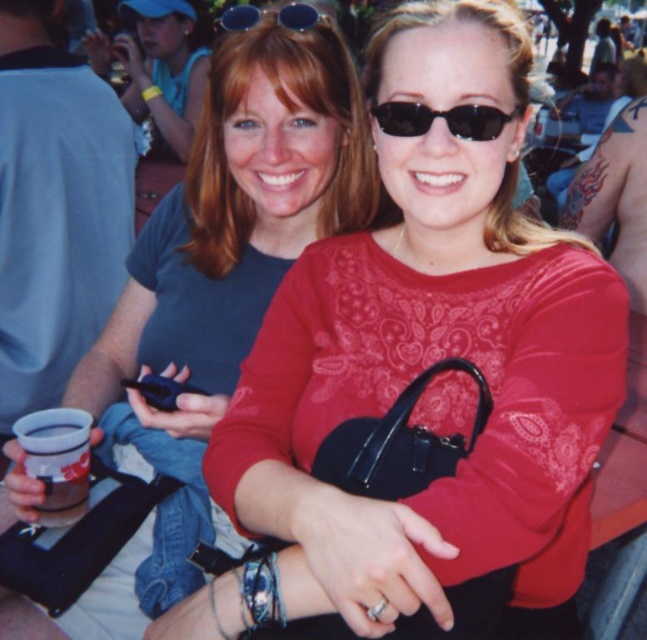
Between point (488, 124) and point (236, 29), which one is positioned in front?

Positioned in front is point (488, 124).

Is the position of black plastic sunglasses at center less distant than that of sunglasses at upper center?

That is True.

Does point (499, 122) come farther from viewer compared to point (280, 20)?

That is False.

Identify the location of black plastic sunglasses at center. The width and height of the screenshot is (647, 640). (441, 116).

The height and width of the screenshot is (640, 647). What do you see at coordinates (225, 260) in the screenshot? I see `matte black purse at center` at bounding box center [225, 260].

Does matte black purse at center have a greater height compared to black plastic sunglasses at center?

Yes.

Describe the element at coordinates (225, 260) in the screenshot. I see `matte black purse at center` at that location.

Locate an element on the screen. The height and width of the screenshot is (640, 647). matte black purse at center is located at coordinates (225, 260).

Between matte black purse at center and sunglasses at upper center, which one is positioned higher?

sunglasses at upper center is above.

Locate an element on the screen. This screenshot has height=640, width=647. matte black purse at center is located at coordinates (225, 260).

The image size is (647, 640). Find the location of `matte black purse at center`. matte black purse at center is located at coordinates tap(225, 260).